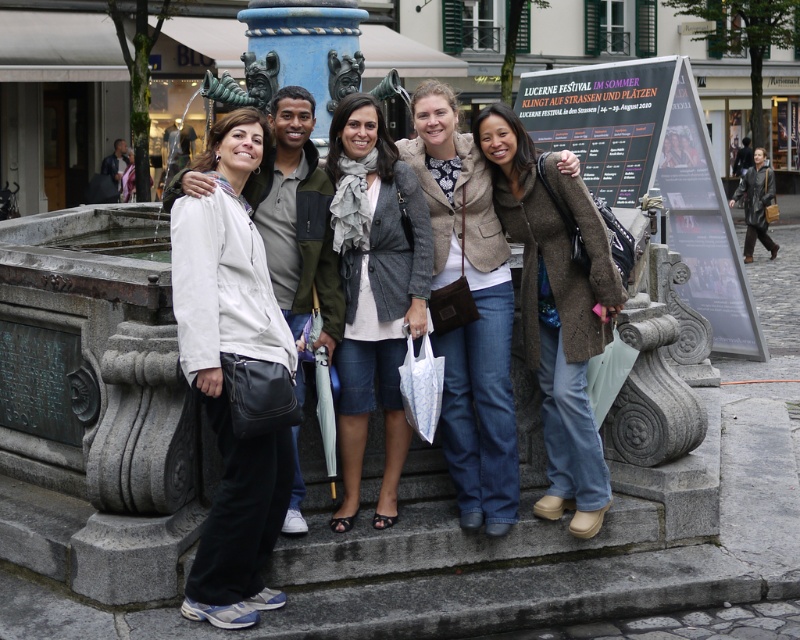
Can you confirm if brown fuzzy coat at center is smaller than light brown textured jacket at center?

Incorrect, brown fuzzy coat at center is not smaller in size than light brown textured jacket at center.

Is point (558, 481) in front of point (468, 172)?

No, (558, 481) is behind (468, 172).

At what (x,y) coordinates should I click in order to perform the action: click on brown fuzzy coat at center. Please return your answer as a coordinate pair (x, y). Looking at the image, I should click on (556, 307).

Find the location of a particular element. The image size is (800, 640). brown fuzzy coat at center is located at coordinates (556, 307).

Does white matte jacket at center lie behind gray woolen scarf at center?

No, it is in front of gray woolen scarf at center.

Who is positioned more to the left, white matte jacket at center or gray woolen scarf at center?

Positioned to the left is white matte jacket at center.

Is point (214, 284) closer to camera compared to point (393, 204)?

Yes, point (214, 284) is in front of point (393, 204).

This screenshot has height=640, width=800. Identify the location of white matte jacket at center. (222, 372).

Is point (245, 611) behind point (466, 164)?

No, (245, 611) is in front of (466, 164).

Where is `white matte jacket at center`? This screenshot has width=800, height=640. white matte jacket at center is located at coordinates (222, 372).

At what (x,y) coordinates should I click in order to perform the action: click on white matte jacket at center. Please return your answer as a coordinate pair (x, y). Looking at the image, I should click on (222, 372).